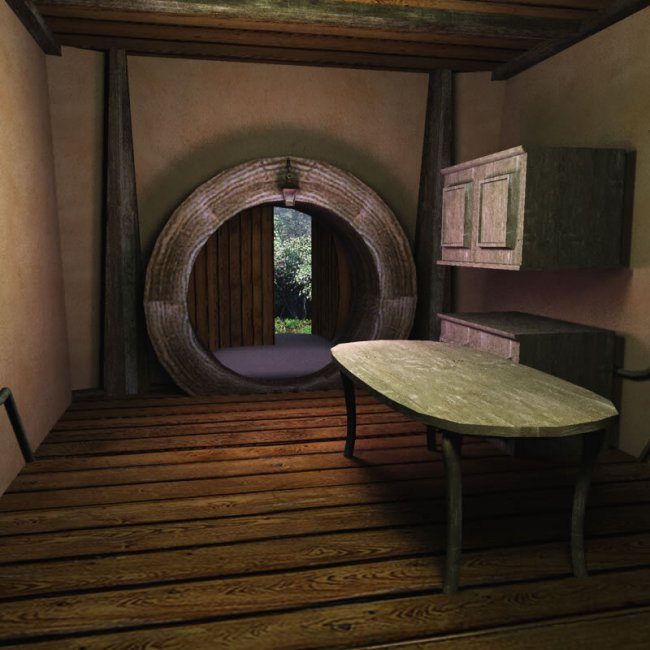
Find the location of a particular element. The width and height of the screenshot is (650, 650). empty walls is located at coordinates (174, 109), (303, 106), (374, 109), (23, 187), (26, 283), (564, 91).